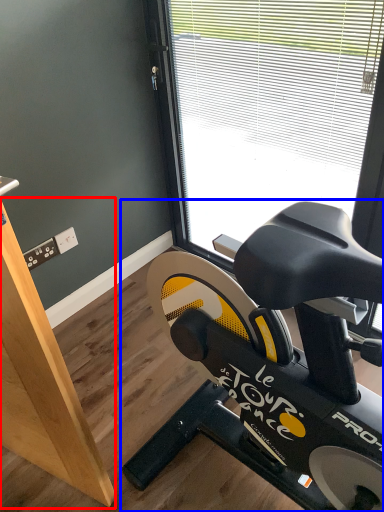
Question: Which point is further to the camera, plywood (highlighted by a red box) or stationary bicycle (highlighted by a blue box)?

Choices:
 (A) plywood
 (B) stationary bicycle

Answer: (B)